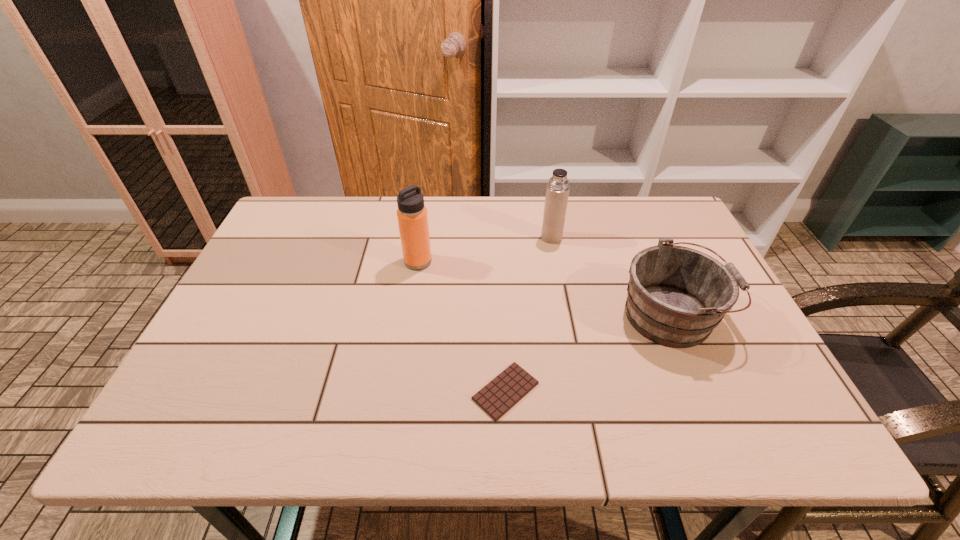
Identify the location of the leftmost object. The height and width of the screenshot is (540, 960). (412, 217).

At what (x,y) coordinates should I click in order to perform the action: click on the second farthest object. Please return your answer as a coordinate pair (x, y). The image size is (960, 540). Looking at the image, I should click on (412, 217).

Locate an element on the screen. the farthest object is located at coordinates point(557,192).

Find the location of a particular element. The image size is (960, 540). the farther thermos bottle is located at coordinates [x=557, y=192].

Image resolution: width=960 pixels, height=540 pixels. In order to click on the rightmost object in this screenshot , I will do `click(676, 296)`.

In order to click on the third farthest object in this screenshot , I will do `click(676, 296)`.

Locate an element on the screen. Image resolution: width=960 pixels, height=540 pixels. chocolate bar is located at coordinates (505, 390).

At what (x,y) coordinates should I click in order to perform the action: click on the nearest object. Please return your answer as a coordinate pair (x, y). The image size is (960, 540). Looking at the image, I should click on (505, 390).

You are a GUI agent. You are given a task and a screenshot of the screen. Output one action in this format:
    pyautogui.click(x=<x>, y=<y>)
    Task: Click on the free space located 0.200m on the back of the nearer thermos bottle
    This screenshot has width=960, height=540.
    Given the screenshot: What is the action you would take?
    pyautogui.click(x=425, y=213)

Locate an element on the screen. free space located 0.300m on the left of the right thermos bottle is located at coordinates (442, 238).